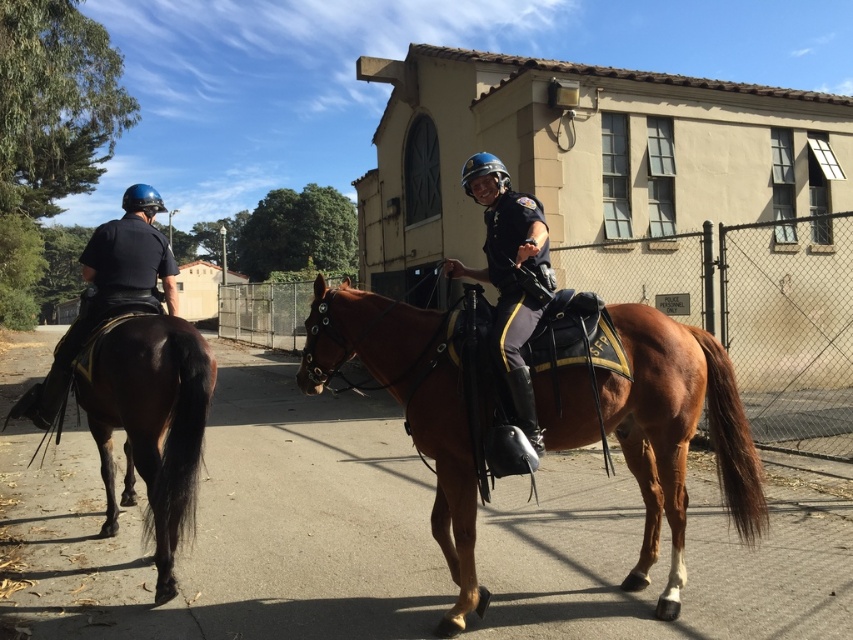
Question: Is shiny black helmet at center positioned at the back of black matte uniform at left?

Choices:
 (A) no
 (B) yes

Answer: (A)

Question: Where is brown leather saddle at center located in relation to shiny black helmet at center in the image?

Choices:
 (A) below
 (B) above

Answer: (A)

Question: Does shiny black helmet at center lie behind black matte uniform at left?

Choices:
 (A) yes
 (B) no

Answer: (B)

Question: Which is nearer to the shiny black helmet at center?

Choices:
 (A) brown leather saddle at center
 (B) black matte uniform at left

Answer: (A)

Question: Which of the following is the farthest from the observer?

Choices:
 (A) (173, 467)
 (B) (167, 253)
 (C) (476, 276)
 (D) (677, 346)

Answer: (B)

Question: Which object is the closest to the brown leather saddle at center?

Choices:
 (A) shiny black helmet at center
 (B) brown glossy horse at left
 (C) black matte uniform at left

Answer: (A)